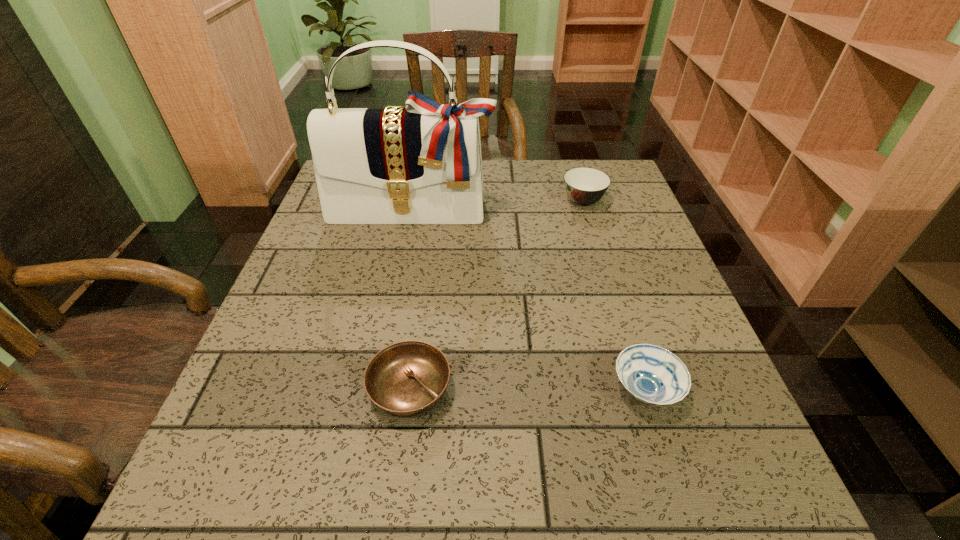
Where is `the tallest object`? This screenshot has width=960, height=540. the tallest object is located at coordinates (422, 164).

Find the location of `the farthest soup bowl`. the farthest soup bowl is located at coordinates (584, 186).

Find the location of a particular element. the tallest soup bowl is located at coordinates (584, 186).

Where is `the leftmost soup bowl`? The height and width of the screenshot is (540, 960). the leftmost soup bowl is located at coordinates (406, 379).

You are a GUI agent. You are given a task and a screenshot of the screen. Output one action in this format:
    pyautogui.click(x=<x>, y=<y>)
    Task: Click on the free space located 0.060m on the front-facing side of the satchel
    The width and height of the screenshot is (960, 540).
    Given the screenshot: What is the action you would take?
    pyautogui.click(x=406, y=244)

At what (x,y) coordinates should I click in order to perform the action: click on vacant space located on the front of the second tallest object. Please return your answer as a coordinate pair (x, y). The width and height of the screenshot is (960, 540). Looking at the image, I should click on (591, 228).

The image size is (960, 540). I want to click on vacant region located 0.260m on the back of the leftmost soup bowl, so click(x=427, y=262).

Where is `satchel positioned at the far edge`? satchel positioned at the far edge is located at coordinates click(x=422, y=164).

Image resolution: width=960 pixels, height=540 pixels. Find the location of `soup bowl present at the far edge`. soup bowl present at the far edge is located at coordinates (584, 186).

The image size is (960, 540). Find the location of `object that is at the left edge`. object that is at the left edge is located at coordinates (422, 164).